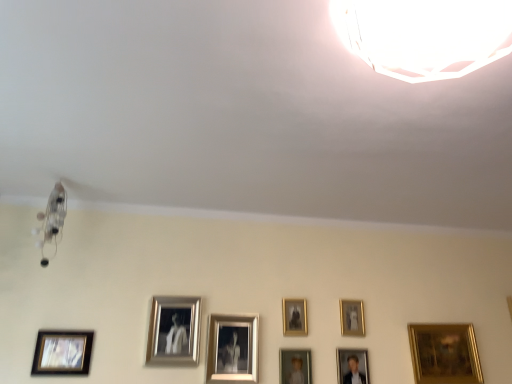
What do you see at coordinates (174, 331) in the screenshot? The width and height of the screenshot is (512, 384). I see `silver metallic picture frame at center, which is the seventh picture frame in right-to-left order` at bounding box center [174, 331].

I want to click on gold metallic picture frame at center, placed as the 3th picture frame when sorted from left to right, so click(232, 348).

This screenshot has width=512, height=384. I want to click on gold-framed photo at lower left, arranged as the 1th picture frame when viewed from the left, so click(x=62, y=352).

What do you see at coordinates (350, 365) in the screenshot?
I see `gold-framed portrait at lower center, the 3th picture frame viewed from the right` at bounding box center [350, 365].

Locate an element on the screen. The image size is (512, 384). gold-framed portrait at center, which is the fourth picture frame from left to right is located at coordinates (295, 366).

What do you see at coordinates (444, 353) in the screenshot? The width and height of the screenshot is (512, 384). I see `gold metallic picture frame at lower right, positioned as the eighth picture frame in left-to-right order` at bounding box center [444, 353].

Measure the distance between gold metallic picture frame at lower right, which is counted as the 1th picture frame, starting from the right, and camera.

A distance of 2.03 meters exists between gold metallic picture frame at lower right, which is counted as the 1th picture frame, starting from the right, and camera.

Where is `gold metallic picture frame at upper center, which ranks as the fourth picture frame in right-to-left order`? This screenshot has height=384, width=512. gold metallic picture frame at upper center, which ranks as the fourth picture frame in right-to-left order is located at coordinates (294, 317).

Where is `white plastic lamp at upper right, which is the second lamp in back-to-front order`? This screenshot has height=384, width=512. white plastic lamp at upper right, which is the second lamp in back-to-front order is located at coordinates (424, 35).

Find the location of `silver metallic picture frame at center, positioned as the 2th picture frame in left-to-right order`. silver metallic picture frame at center, positioned as the 2th picture frame in left-to-right order is located at coordinates (174, 331).

Considering the sizes of gold metallic picture frame at center, placed as the 3th picture frame when sorted from left to right, and gold-framed portrait at center, which is the fourth picture frame from left to right, in the image, is gold metallic picture frame at center, placed as the 3th picture frame when sorted from left to right, wider or thinner than gold-framed portrait at center, which is the fourth picture frame from left to right,?

gold metallic picture frame at center, placed as the 3th picture frame when sorted from left to right, is wider than gold-framed portrait at center, which is the fourth picture frame from left to right.

Is gold metallic picture frame at center, placed as the 3th picture frame when sorted from left to right, completely or partially outside of gold-framed portrait at center, which is the fourth picture frame from left to right?

Yes, gold metallic picture frame at center, placed as the 3th picture frame when sorted from left to right, is not within gold-framed portrait at center, which is the fourth picture frame from left to right.

Can you confirm if gold metallic picture frame at center, placed as the 3th picture frame when sorted from left to right, is positioned to the left of gold-framed portrait at center, the 5th picture frame positioned from the right?

Yes.

Is gold metallic picture frame at center, placed as the 3th picture frame when sorted from left to right, not close to gold-framed portrait at center, which is the fourth picture frame from left to right?

They are positioned close to each other.

Is metallic glass chandelier at upper left, which is the first lamp in back-to-front order, situated inside gold metallic picture frame at lower right, which is counted as the 1th picture frame, starting from the right, or outside?

metallic glass chandelier at upper left, which is the first lamp in back-to-front order, lies outside gold metallic picture frame at lower right, which is counted as the 1th picture frame, starting from the right.

Considering the points (60, 190) and (439, 357), which point is behind, point (60, 190) or point (439, 357)?

The point (439, 357) is farther from the camera.

Is metallic glass chandelier at upper left, marked as the second lamp in a top-to-bottom arrangement, directly adjacent to gold metallic picture frame at lower right, positioned as the eighth picture frame in left-to-right order?

No, metallic glass chandelier at upper left, marked as the second lamp in a top-to-bottom arrangement, is not with gold metallic picture frame at lower right, positioned as the eighth picture frame in left-to-right order.

How different are the orientations of silver metallic picture frame at center, positioned as the 2th picture frame in left-to-right order, and white plastic lamp at upper right, the second lamp when ordered from bottom to top, in degrees?

The facing directions of silver metallic picture frame at center, positioned as the 2th picture frame in left-to-right order, and white plastic lamp at upper right, the second lamp when ordered from bottom to top, are 88.2 degrees apart.

Is silver metallic picture frame at center, positioned as the 2th picture frame in left-to-right order, wider than white plastic lamp at upper right, the 1th lamp viewed from the top?

No, silver metallic picture frame at center, positioned as the 2th picture frame in left-to-right order, is not wider than white plastic lamp at upper right, the 1th lamp viewed from the top.

Consider the image. Is silver metallic picture frame at center, which is the seventh picture frame in right-to-left order, surrounding white plastic lamp at upper right, which appears as the first lamp when viewed from the right?

No.

From the image's perspective, is silver metallic picture frame at center, which is the seventh picture frame in right-to-left order, located above or below white plastic lamp at upper right, which is the second lamp in back-to-front order?

Clearly, from the image's perspective, silver metallic picture frame at center, which is the seventh picture frame in right-to-left order, is below white plastic lamp at upper right, which is the second lamp in back-to-front order.

Which object is more forward, gold metallic picture frame at lower right, positioned as the eighth picture frame in left-to-right order, or gold metallic picture frame at center, positioned as the sixth picture frame in right-to-left order?

Positioned in front is gold metallic picture frame at center, positioned as the sixth picture frame in right-to-left order.

How different are the orientations of gold metallic picture frame at lower right, positioned as the eighth picture frame in left-to-right order, and gold metallic picture frame at center, placed as the 3th picture frame when sorted from left to right, in degrees?

0.597 degrees.

Does point (465, 371) come behind point (255, 378)?

That is True.

In order to click on the 3rd picture frame behind the gold metallic picture frame at center, positioned as the sixth picture frame in right-to-left order in this screenshot , I will do `click(444, 353)`.

Do you think gold metallic picture frame at lower right, positioned as the eighth picture frame in left-to-right order, is within metallic glass chandelier at upper left, the first lamp from the bottom, or outside of it?

gold metallic picture frame at lower right, positioned as the eighth picture frame in left-to-right order, is outside metallic glass chandelier at upper left, the first lamp from the bottom.

Which object is positioned more to the left, gold metallic picture frame at lower right, which is counted as the 1th picture frame, starting from the right, or metallic glass chandelier at upper left, which is the first lamp in back-to-front order?

metallic glass chandelier at upper left, which is the first lamp in back-to-front order.

Is gold metallic picture frame at lower right, which is counted as the 1th picture frame, starting from the right, closer to camera compared to metallic glass chandelier at upper left, the first lamp from the bottom?

No, gold metallic picture frame at lower right, which is counted as the 1th picture frame, starting from the right, is further to the viewer.

Is gold metallic picture frame at lower right, which is counted as the 1th picture frame, starting from the right, thinner than metallic glass chandelier at upper left, which ranks as the second lamp in front-to-back order?

Indeed, gold metallic picture frame at lower right, which is counted as the 1th picture frame, starting from the right, has a lesser width compared to metallic glass chandelier at upper left, which ranks as the second lamp in front-to-back order.

Can gold-framed photo at lower left, arranged as the 1th picture frame when viewed from the left, be found inside gold metallic picture frame at upper right, acting as the second picture frame starting from the right?

No, gold-framed photo at lower left, arranged as the 1th picture frame when viewed from the left, is located outside of gold metallic picture frame at upper right, acting as the second picture frame starting from the right.

From the image's perspective, is gold metallic picture frame at upper right, the seventh picture frame positioned from the left, over gold-framed photo at lower left, which is the eighth picture frame from right to left?

Indeed, from the image's perspective, gold metallic picture frame at upper right, the seventh picture frame positioned from the left, is shown above gold-framed photo at lower left, which is the eighth picture frame from right to left.

Is gold metallic picture frame at upper right, the seventh picture frame positioned from the left, next to gold-framed photo at lower left, which is the eighth picture frame from right to left?

gold metallic picture frame at upper right, the seventh picture frame positioned from the left, and gold-framed photo at lower left, which is the eighth picture frame from right to left, are not in contact.

Are white plastic lamp at upper right, the 1th lamp viewed from the top, and gold-framed photo at lower left, which is the eighth picture frame from right to left, far apart?

Absolutely, white plastic lamp at upper right, the 1th lamp viewed from the top, is distant from gold-framed photo at lower left, which is the eighth picture frame from right to left.

From the image's perspective, is white plastic lamp at upper right, the 1th lamp viewed from the top, located beneath gold-framed photo at lower left, arranged as the 1th picture frame when viewed from the left?

Incorrect, from the image's perspective, white plastic lamp at upper right, the 1th lamp viewed from the top, is higher than gold-framed photo at lower left, arranged as the 1th picture frame when viewed from the left.

Which is correct: white plastic lamp at upper right, which is the second lamp in back-to-front order, is inside gold-framed photo at lower left, arranged as the 1th picture frame when viewed from the left, or outside of it?

white plastic lamp at upper right, which is the second lamp in back-to-front order, cannot be found inside gold-framed photo at lower left, arranged as the 1th picture frame when viewed from the left.

This screenshot has width=512, height=384. In order to click on picture frame that is the 1st object to the left of the gold-framed portrait at center, which is the fourth picture frame from left to right, starting at the anchor in this screenshot , I will do `click(232, 348)`.

From the image's perspective, which lamp is the 1st one above the gold metallic picture frame at lower right, which is counted as the 1th picture frame, starting from the right? Please provide its 2D coordinates.

[(52, 220)]

From the image, which object appears to be nearer to gold-framed portrait at center, the 5th picture frame positioned from the right, metallic glass chandelier at upper left, positioned as the first lamp in left-to-right order, or gold metallic picture frame at upper center, positioned as the 5th picture frame in left-to-right order?

gold metallic picture frame at upper center, positioned as the 5th picture frame in left-to-right order, is positioned closer to the anchor gold-framed portrait at center, the 5th picture frame positioned from the right.

When comparing their distances from gold metallic picture frame at lower right, positioned as the eighth picture frame in left-to-right order, does gold-framed photo at lower left, which is the eighth picture frame from right to left, or metallic glass chandelier at upper left, the first lamp from the bottom, seem further?

The object further to gold metallic picture frame at lower right, positioned as the eighth picture frame in left-to-right order, is metallic glass chandelier at upper left, the first lamp from the bottom.

From the image, which object appears to be nearer to gold-framed portrait at lower center, the sixth picture frame viewed from the left, gold metallic picture frame at lower right, positioned as the eighth picture frame in left-to-right order, or white plastic lamp at upper right, which is the 2th lamp in left-to-right order?

gold metallic picture frame at lower right, positioned as the eighth picture frame in left-to-right order, is closer to gold-framed portrait at lower center, the sixth picture frame viewed from the left.

Which object lies nearer to the anchor point white plastic lamp at upper right, the 1th lamp viewed from the top, gold-framed portrait at lower center, the sixth picture frame viewed from the left, or silver metallic picture frame at center, positioned as the 2th picture frame in left-to-right order?

silver metallic picture frame at center, positioned as the 2th picture frame in left-to-right order, is positioned closer to the anchor white plastic lamp at upper right, the 1th lamp viewed from the top.

Considering their positions, is gold metallic picture frame at upper center, positioned as the 5th picture frame in left-to-right order, positioned further to gold metallic picture frame at lower right, positioned as the eighth picture frame in left-to-right order, than white plastic lamp at upper right, which is the second lamp in back-to-front order?

white plastic lamp at upper right, which is the second lamp in back-to-front order.

Which object lies nearer to the anchor point gold metallic picture frame at center, placed as the 3th picture frame when sorted from left to right, gold-framed photo at lower left, arranged as the 1th picture frame when viewed from the left, or metallic glass chandelier at upper left, which is the first lamp in back-to-front order?

Based on the image, gold-framed photo at lower left, arranged as the 1th picture frame when viewed from the left, appears to be nearer to gold metallic picture frame at center, placed as the 3th picture frame when sorted from left to right.

Based on their spatial positions, is gold-framed photo at lower left, arranged as the 1th picture frame when viewed from the left, or gold metallic picture frame at center, placed as the 3th picture frame when sorted from left to right, further from white plastic lamp at upper right, acting as the 1th lamp starting from the front?

The object further to white plastic lamp at upper right, acting as the 1th lamp starting from the front, is gold-framed photo at lower left, arranged as the 1th picture frame when viewed from the left.

In the scene shown: Looking at the image, which one is located closer to gold metallic picture frame at center, positioned as the sixth picture frame in right-to-left order, white plastic lamp at upper right, which appears as the first lamp when viewed from the right, or gold metallic picture frame at upper center, which ranks as the fourth picture frame in right-to-left order?

A: gold metallic picture frame at upper center, which ranks as the fourth picture frame in right-to-left order, is positioned closer to the anchor gold metallic picture frame at center, positioned as the sixth picture frame in right-to-left order.

This screenshot has height=384, width=512. Identify the location of lamp located between gold-framed photo at lower left, arranged as the 1th picture frame when viewed from the left, and gold-framed portrait at lower center, the 3th picture frame viewed from the right, in the left-right direction. (424, 35).

Find the location of `lamp between silver metallic picture frame at center, positioned as the 2th picture frame in left-to-right order, and gold metallic picture frame at lower right, positioned as the eighth picture frame in left-to-right order, from left to right`. lamp between silver metallic picture frame at center, positioned as the 2th picture frame in left-to-right order, and gold metallic picture frame at lower right, positioned as the eighth picture frame in left-to-right order, from left to right is located at coordinates (424, 35).

Locate an element on the screen. Image resolution: width=512 pixels, height=384 pixels. picture frame situated between silver metallic picture frame at center, positioned as the 2th picture frame in left-to-right order, and gold-framed portrait at center, the 5th picture frame positioned from the right, from left to right is located at coordinates (232, 348).

At what (x,y) coordinates should I click in order to perform the action: click on picture frame between gold metallic picture frame at center, positioned as the sixth picture frame in right-to-left order, and gold metallic picture frame at upper center, which ranks as the fourth picture frame in right-to-left order, in the horizontal direction. Please return your answer as a coordinate pair (x, y). This screenshot has height=384, width=512. Looking at the image, I should click on (295, 366).